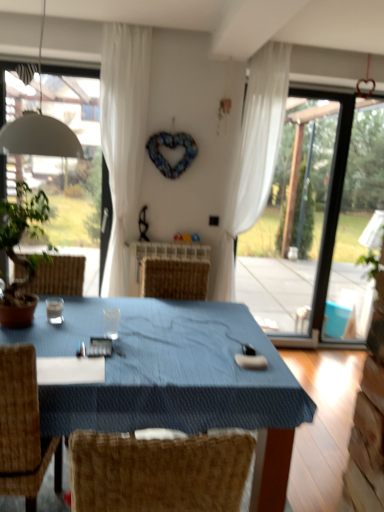
Question: Is white sheer curtain at upper center, the first curtain positioned from the right, inside the boundaries of transparent glass coffee cup at center, or outside?

Choices:
 (A) inside
 (B) outside

Answer: (B)

Question: From the image's perspective, is white sheer curtain at upper center, the 2th curtain from the left, positioned above or below transparent glass coffee cup at center?

Choices:
 (A) above
 (B) below

Answer: (A)

Question: Which object is the farthest from the white matte lampshade at upper left?

Choices:
 (A) blue fabric table at center
 (B) white sheer curtain at upper center, the first curtain positioned from the right
 (C) woven wood chair at lower left
 (D) green leafy plant at left
 (E) white sheer curtain at center, which appears as the 1th curtain when viewed from the left

Answer: (B)

Question: Estimate the real-world distances between objects in this image. Which object is closer to the white sheer curtain at upper center, the 2th curtain from the left?

Choices:
 (A) transparent glass coffee cup at center
 (B) green leafy plant at left
 (C) white sheer curtain at center, the second curtain in the right-to-left sequence
 (D) blue fabric table at center
 (E) white matte lampshade at upper left

Answer: (C)